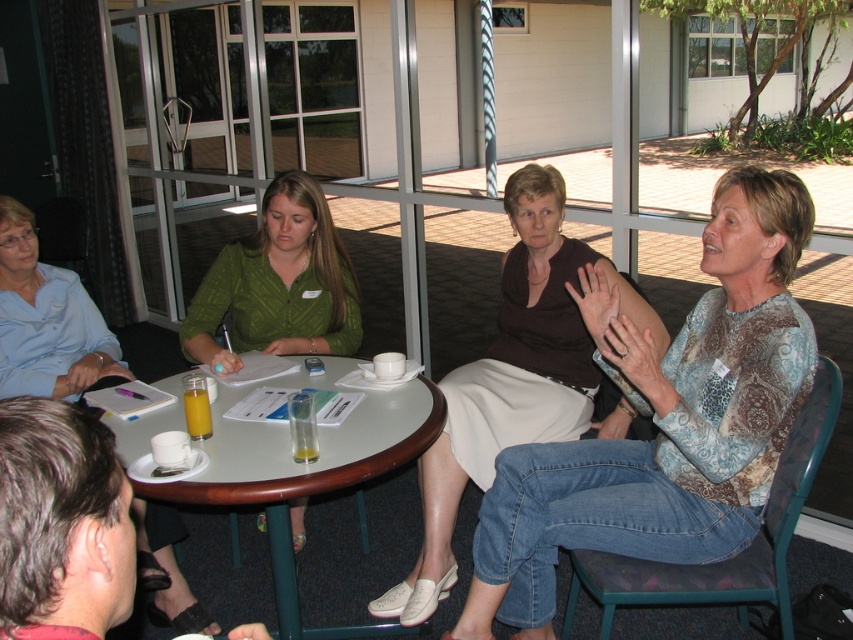
Is point (535, 577) positioned after point (194, 317)?

No, it is not.

Who is taller, patterned fabric blouse at center or green textured blouse at center?

Standing taller between the two is patterned fabric blouse at center.

This screenshot has height=640, width=853. I want to click on patterned fabric blouse at center, so click(x=663, y=420).

This screenshot has width=853, height=640. What are the coordinates of `patterned fabric blouse at center` in the screenshot? It's located at (663, 420).

Can you confirm if patterned fabric blouse at center is thinner than textured fabric chair at lower right?

In fact, patterned fabric blouse at center might be wider than textured fabric chair at lower right.

Between point (772, 420) and point (595, 600), which one is positioned in front?

Positioned in front is point (772, 420).

Identify the location of patterned fabric blouse at center. The width and height of the screenshot is (853, 640). (663, 420).

Identify the location of patterned fabric blouse at center. This screenshot has height=640, width=853. (663, 420).

Looking at this image, can you confirm if patterned fabric blouse at center is positioned above brown jersey at center?

No, patterned fabric blouse at center is not above brown jersey at center.

Is patterned fabric blouse at center to the right of brown jersey at center from the viewer's perspective?

Correct, you'll find patterned fabric blouse at center to the right of brown jersey at center.

Which is behind, point (798, 196) or point (520, 172)?

The point (520, 172) is behind.

Image resolution: width=853 pixels, height=640 pixels. Identify the location of patterned fabric blouse at center. (663, 420).